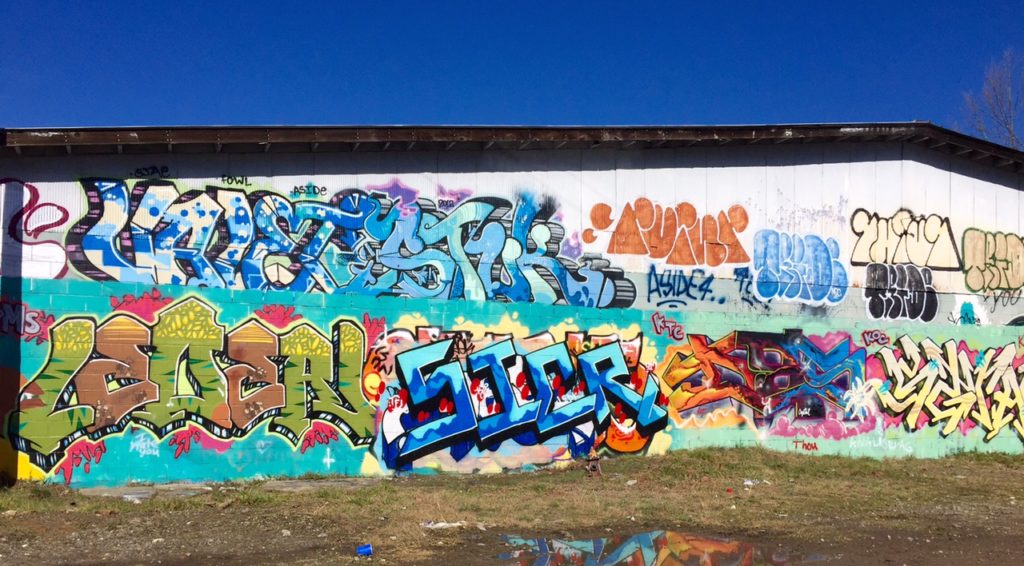
This screenshot has width=1024, height=566. I want to click on cup, so click(359, 550).